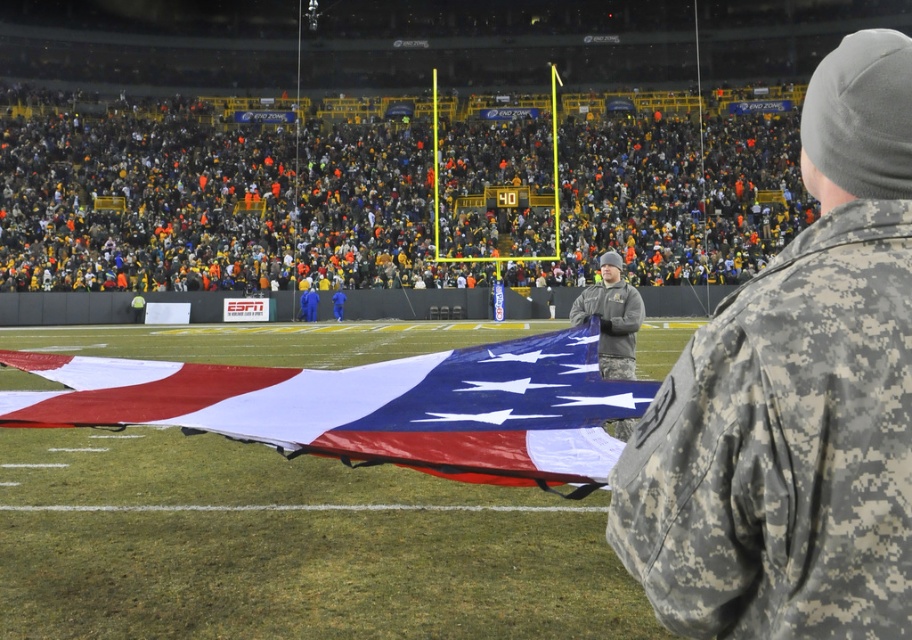
You are a photographer positioned at the origin point of the image. You want to capture a photo of the polyester american flag at center without including any of the spectators in the background. Based on its 2D coordinates, can you determine if the flag is positioned in a way that allows this?

The polyester american flag at center is located at coordinates (370,406). Since these coordinates are within the central area of the image, it is likely positioned in a way that allows capturing it without including spectators in the background.

Consider the image. You are a photographer at the stadium and need to capture both the camouflage uniform at center and the camouflage fabric uniform at right in a single photo. Which uniform should you focus on first to ensure both are in frame?

The camouflage uniform at center is much taller than the camouflage fabric uniform at right, so you should focus on the camouflage uniform at center first to ensure both are in frame.

You are a photographer standing at the center of the stadium. You want to capture a photo of the polyester american flag at center without any obstructions. Considering the crowd density, is the area around point (370,406) clear enough for an unobstructed view?

The area around point (370,406) is clear enough for an unobstructed view since the polyester american flag at center is located there, and the description does not mention any obstructions at that specific point.